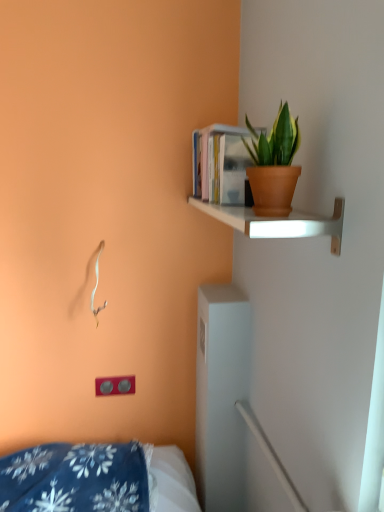
Question: In the image, is hardcover books at upper right positioned in front of or behind terracotta pot at upper right?

Choices:
 (A) front
 (B) behind

Answer: (B)

Question: Considering the positions of point 196,187 and point 281,164, is point 196,187 closer or farther from the camera than point 281,164?

Choices:
 (A) closer
 (B) farther

Answer: (B)

Question: Estimate the real-world distances between objects in this image. Which object is closer to the matte white shelf at upper right?

Choices:
 (A) matte gray electric outlet at lower left
 (B) hardcover books at upper right
 (C) terracotta pot at upper right

Answer: (C)

Question: Estimate the real-world distances between objects in this image. Which object is farther from the matte white shelf at upper right?

Choices:
 (A) matte gray electric outlet at lower left
 (B) terracotta pot at upper right
 (C) hardcover books at upper right

Answer: (A)